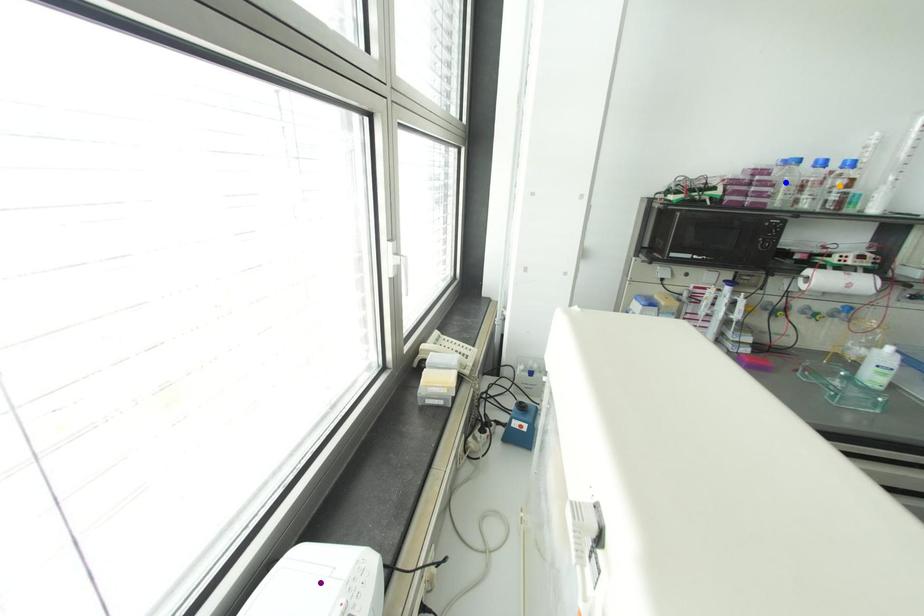
Order these from nearest to farthest:
1. orange point
2. purple point
3. blue point

orange point, blue point, purple point